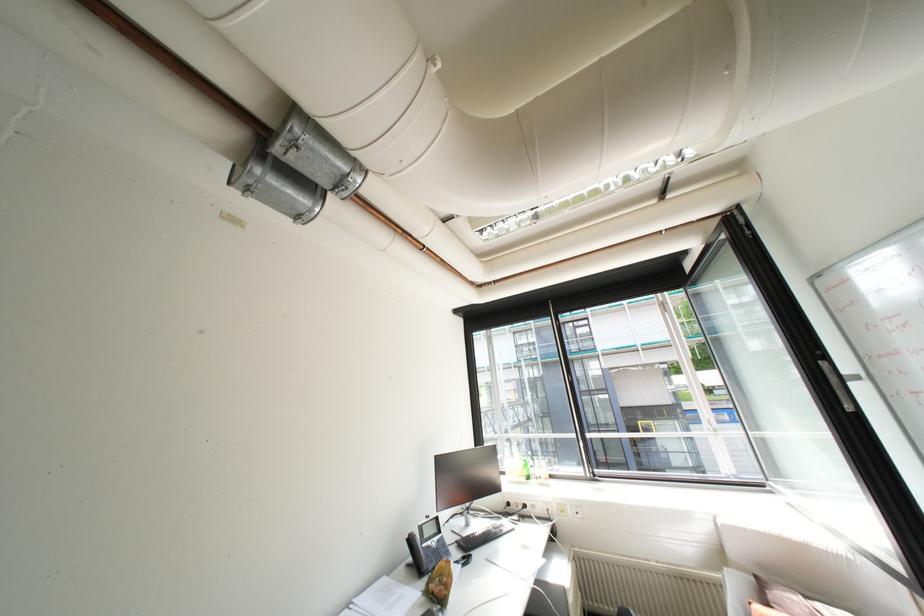
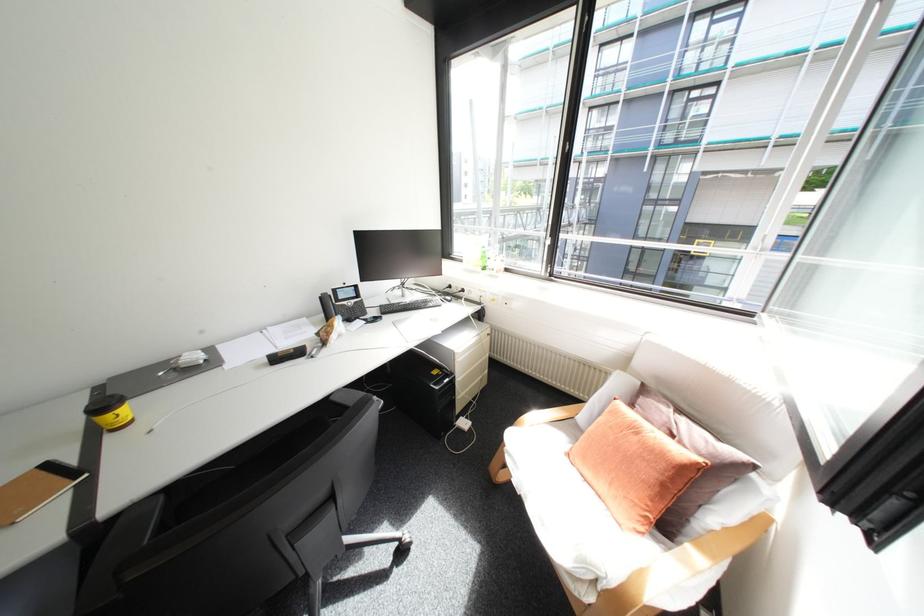
Where in the second image is the point corresponding to point (417, 537) from the first image?

(330, 296)